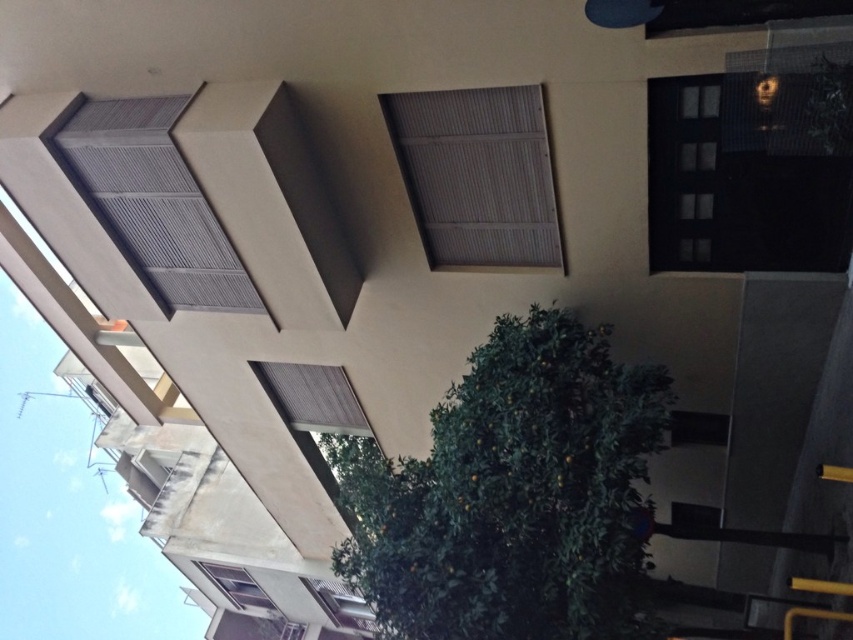
Who is higher up, matte gray window at center or matte gray window at lower left?

matte gray window at center is higher up.

Locate an element on the screen. matte gray window at center is located at coordinates (315, 413).

Where is `matte gray window at center`? This screenshot has width=853, height=640. matte gray window at center is located at coordinates [x=315, y=413].

This screenshot has width=853, height=640. Find the location of `gray matte window at upper left`. gray matte window at upper left is located at coordinates (154, 202).

Which is below, gray matte window at upper left or matte gray window at center?

matte gray window at center is lower down.

Who is more forward, (148, 131) or (345, 403)?

Point (148, 131)

The image size is (853, 640). Identify the location of gray matte window at upper left. (154, 202).

Who is taller, matte gray shutters at center or gray matte window at upper left?

gray matte window at upper left is taller.

From the picture: Is matte gray shutters at center thinner than gray matte window at upper left?

Indeed, matte gray shutters at center has a lesser width compared to gray matte window at upper left.

Which is in front, point (508, 156) or point (67, 161)?

Point (508, 156) is more forward.

Where is `matte gray shutters at center`? The height and width of the screenshot is (640, 853). matte gray shutters at center is located at coordinates (477, 173).